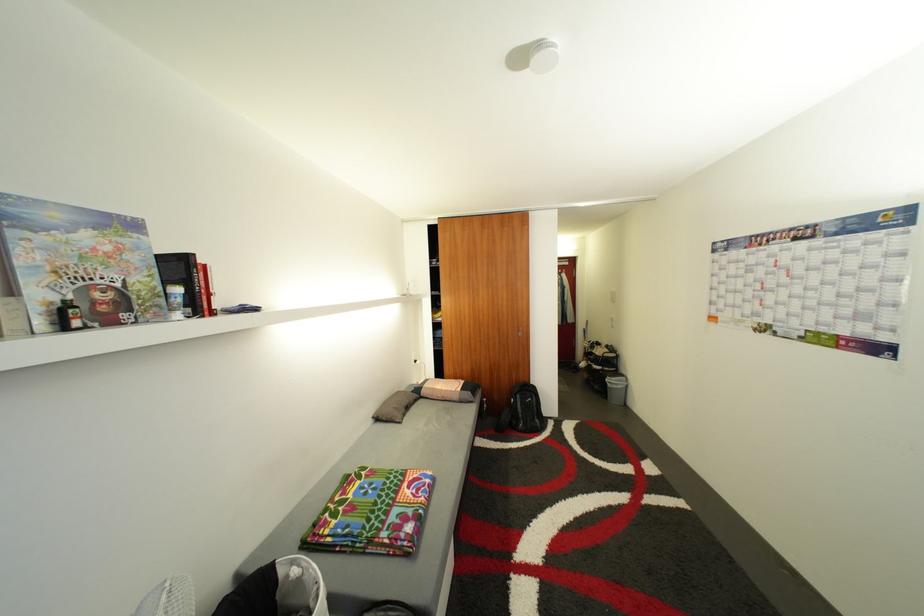
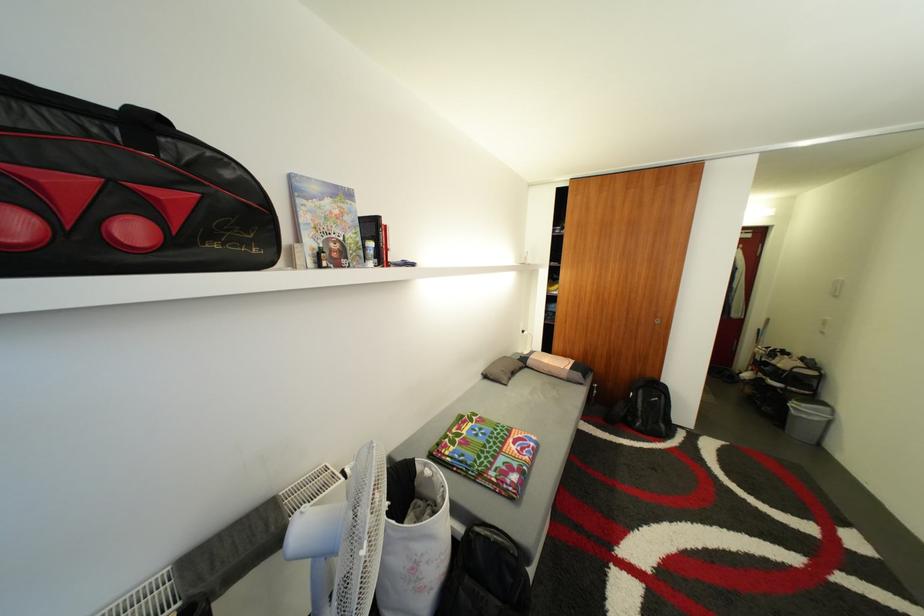
Question: The camera is either moving clockwise (left) or counter-clockwise (right) around the object. The first image is from the beginning of the video and the second image is from the end. Is the camera moving left or right when shooting the video?

Choices:
 (A) Left
 (B) Right

Answer: (B)